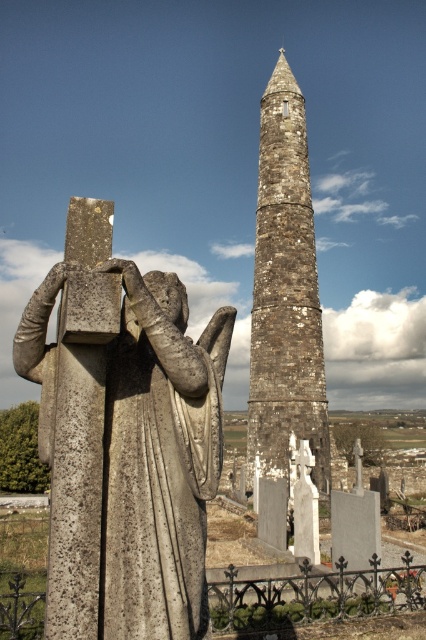
Between gray stone statue at center and rustic stone tower at center, which one appears on the right side from the viewer's perspective?

rustic stone tower at center is more to the right.

Is point (198, 385) positioned in front of point (252, 332)?

That is True.

Does point (193, 596) come closer to viewer compared to point (299, 397)?

Yes, point (193, 596) is closer to viewer.

The image size is (426, 640). Find the location of `gray stone statue at center`. gray stone statue at center is located at coordinates (123, 440).